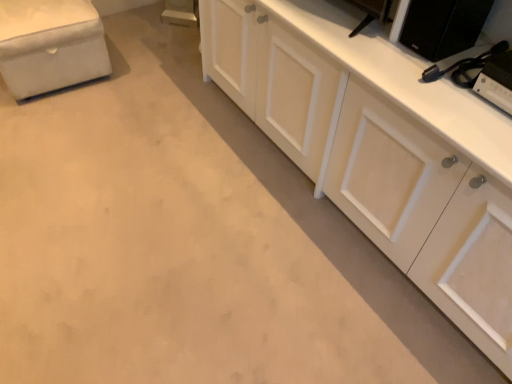
Question: Is black matte speaker at upper right, the second appliance when ordered from bottom to top, positioned far away from white wood cabinet at right?

Choices:
 (A) no
 (B) yes

Answer: (A)

Question: Can you confirm if black matte speaker at upper right, acting as the first appliance starting from the top, is thinner than white wood cabinet at right?

Choices:
 (A) yes
 (B) no

Answer: (A)

Question: From a real-world perspective, is black matte speaker at upper right, acting as the first appliance starting from the top, positioned under white wood cabinet at right based on gravity?

Choices:
 (A) yes
 (B) no

Answer: (B)

Question: Is the position of black matte speaker at upper right, the second appliance when ordered from bottom to top, more distant than that of white wood cabinet at right?

Choices:
 (A) yes
 (B) no

Answer: (A)

Question: From the image's perspective, would you say black matte speaker at upper right, acting as the first appliance starting from the top, is positioned over white wood cabinet at right?

Choices:
 (A) yes
 (B) no

Answer: (A)

Question: Could you tell me if black matte speaker at upper right, acting as the first appliance starting from the top, is turned towards white wood cabinet at right?

Choices:
 (A) no
 (B) yes

Answer: (B)

Question: Does white wood cabinet at right have a smaller size compared to black plastic game console at upper right, the second appliance positioned from the top?

Choices:
 (A) yes
 (B) no

Answer: (B)

Question: Is the depth of white wood cabinet at right greater than that of black plastic game console at upper right, arranged as the 1th appliance when ordered from the bottom?

Choices:
 (A) no
 (B) yes

Answer: (A)

Question: From a real-world perspective, is white wood cabinet at right on top of black plastic game console at upper right, arranged as the 1th appliance when ordered from the bottom?

Choices:
 (A) no
 (B) yes

Answer: (A)

Question: Can you confirm if white wood cabinet at right is wider than black plastic game console at upper right, arranged as the 1th appliance when ordered from the bottom?

Choices:
 (A) yes
 (B) no

Answer: (A)

Question: Does white wood cabinet at right have a larger size compared to black plastic game console at upper right, arranged as the 1th appliance when ordered from the bottom?

Choices:
 (A) yes
 (B) no

Answer: (A)

Question: Would you say white wood cabinet at right contains black plastic game console at upper right, the second appliance positioned from the top?

Choices:
 (A) no
 (B) yes

Answer: (B)

Question: Considering the relative sizes of black plastic game console at upper right, arranged as the 1th appliance when ordered from the bottom, and white wood cabinet at right in the image provided, is black plastic game console at upper right, arranged as the 1th appliance when ordered from the bottom, wider than white wood cabinet at right?

Choices:
 (A) yes
 (B) no

Answer: (B)